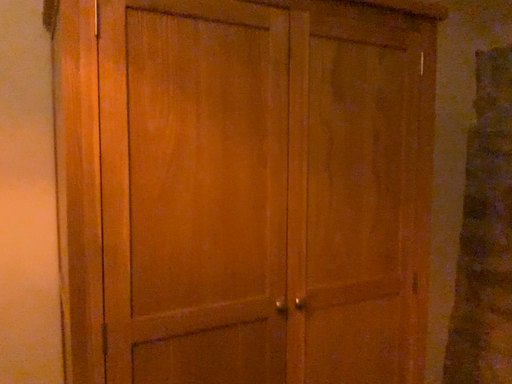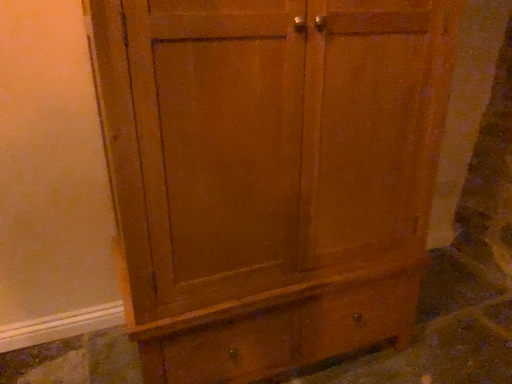
Question: Which way did the camera rotate in the video?

Choices:
 (A) rotated upward
 (B) rotated downward

Answer: (B)